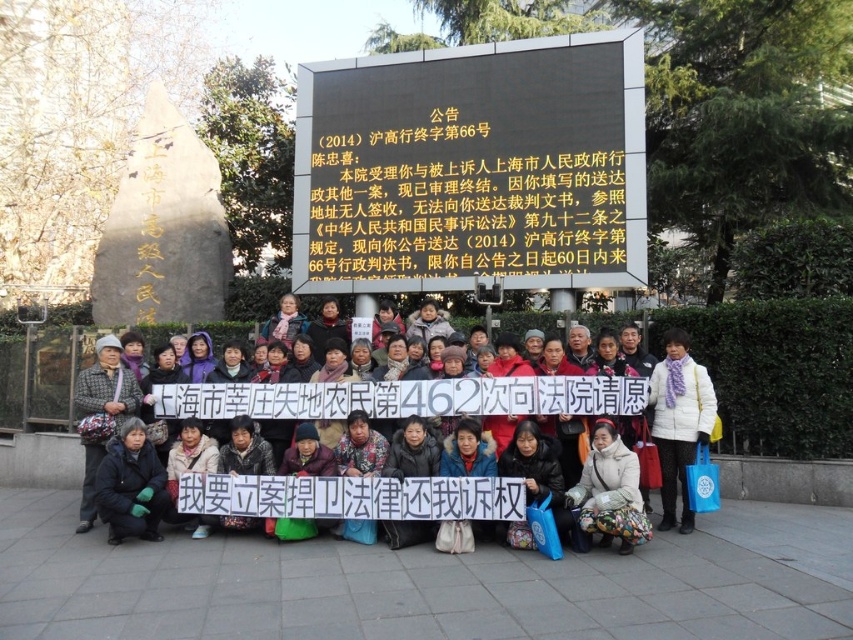
Is dark gray winter coat at center bigger than white woolen scarf at center?

Correct, dark gray winter coat at center is larger in size than white woolen scarf at center.

Does dark gray winter coat at center appear over white woolen scarf at center?

No.

Does point (526, 369) come behind point (660, 403)?

Yes, it is.

Find the location of a particular element. The height and width of the screenshot is (640, 853). dark gray winter coat at center is located at coordinates (416, 396).

Is black lcd screen at upper center below white woolen scarf at center?

No.

Who is higher up, black lcd screen at upper center or white woolen scarf at center?

black lcd screen at upper center

Is point (318, 109) farther from camera compared to point (680, 529)?

Yes, it is.

You are a GUI agent. You are given a task and a screenshot of the screen. Output one action in this format:
    pyautogui.click(x=<x>, y=<y>)
    Task: Click on the black lcd screen at upper center
    The width and height of the screenshot is (853, 640).
    Given the screenshot: What is the action you would take?
    pyautogui.click(x=473, y=168)

Between black lcd screen at upper center and dark gray winter coat at center, which one is positioned higher?

black lcd screen at upper center

Is black lcd screen at upper center bigger than dark gray winter coat at center?

Actually, black lcd screen at upper center might be smaller than dark gray winter coat at center.

Between point (491, 225) and point (395, 413), which one is positioned behind?

Positioned behind is point (491, 225).

This screenshot has height=640, width=853. I want to click on black lcd screen at upper center, so coord(473,168).